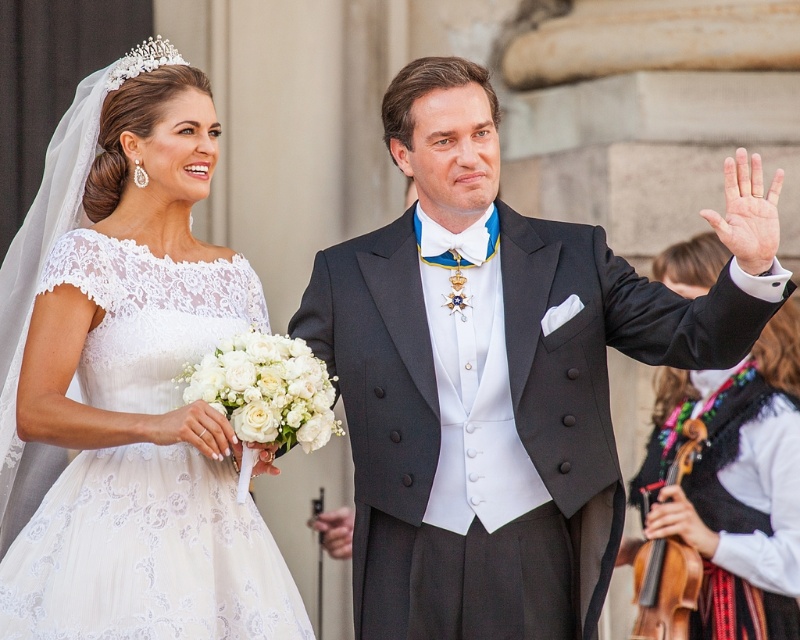
Question: Which point is closer to the camera taking this photo?

Choices:
 (A) (694, 284)
 (B) (14, 468)
 (C) (512, 438)
 (D) (466, 253)

Answer: (C)

Question: Is black knit vest at right positioned in front of white satin bow tie at center?

Choices:
 (A) yes
 (B) no

Answer: (A)

Question: Is white satin bow tie at center thinner than pearl/ivory tiara at upper left?

Choices:
 (A) yes
 (B) no

Answer: (A)

Question: Which point is closer to the camera?

Choices:
 (A) (64, 298)
 (B) (434, 246)

Answer: (A)

Question: Based on their relative distances, which object is nearer to the black knit vest at right?

Choices:
 (A) white satin bow tie at center
 (B) matte black suit at center

Answer: (B)

Question: Does white lace dress at upper left have a lesser width compared to white satin bow tie at center?

Choices:
 (A) yes
 (B) no

Answer: (B)